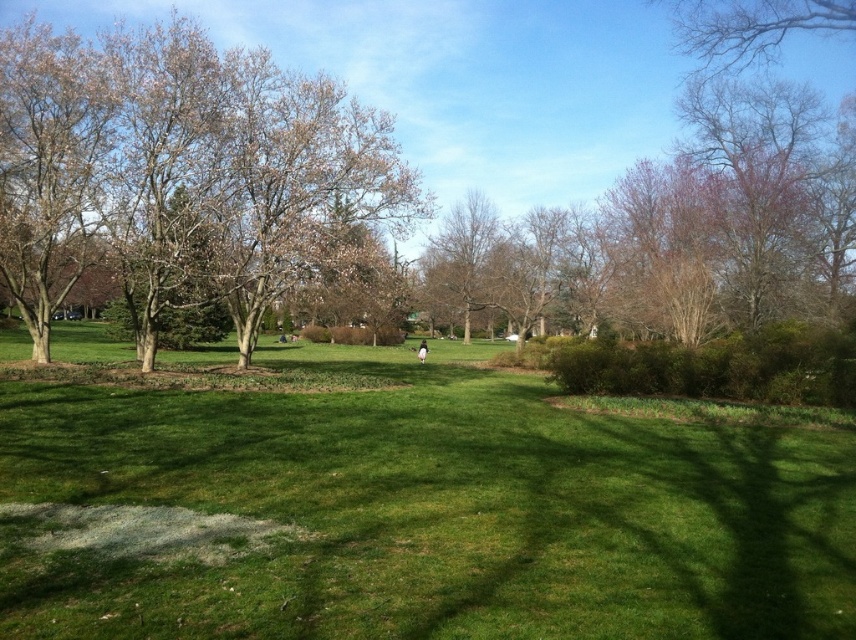
Question: In this image, where is green grass at center located relative to bare branches at left?

Choices:
 (A) right
 (B) left

Answer: (A)

Question: Which point is farther to the camera?

Choices:
 (A) bare branches at left
 (B) green grass at center

Answer: (A)

Question: Which of the following is the closest to the observer?

Choices:
 (A) bare branches at left
 (B) green grass at center

Answer: (B)

Question: Is green grass at center further to camera compared to bare branches at left?

Choices:
 (A) no
 (B) yes

Answer: (A)

Question: Can you confirm if green grass at center is positioned to the right of bare branches at left?

Choices:
 (A) no
 (B) yes

Answer: (B)